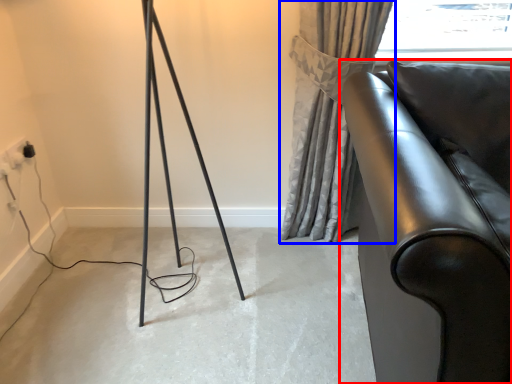
Question: Among these objects, which one is farthest to the camera, furniture (highlighted by a red box) or curtain (highlighted by a blue box)?

Choices:
 (A) furniture
 (B) curtain

Answer: (B)